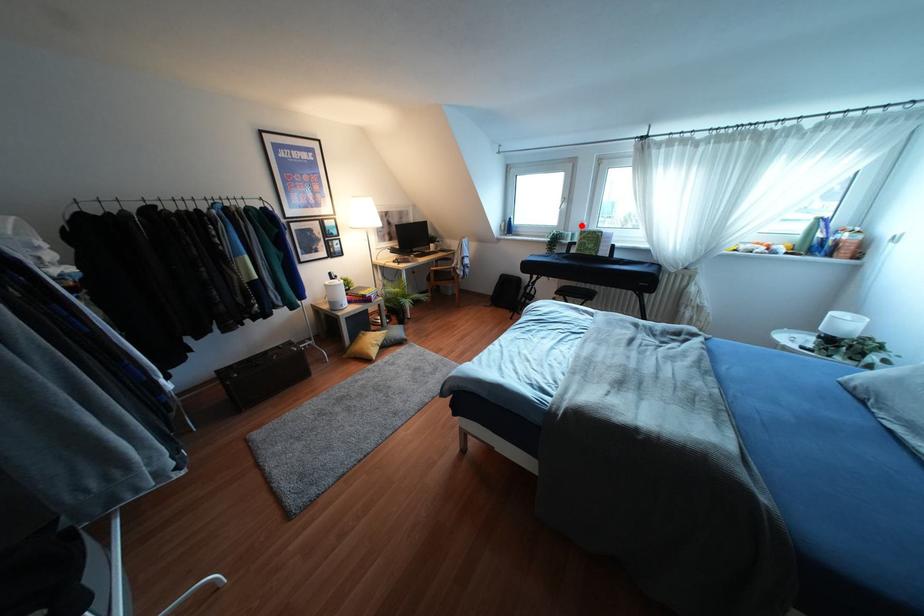
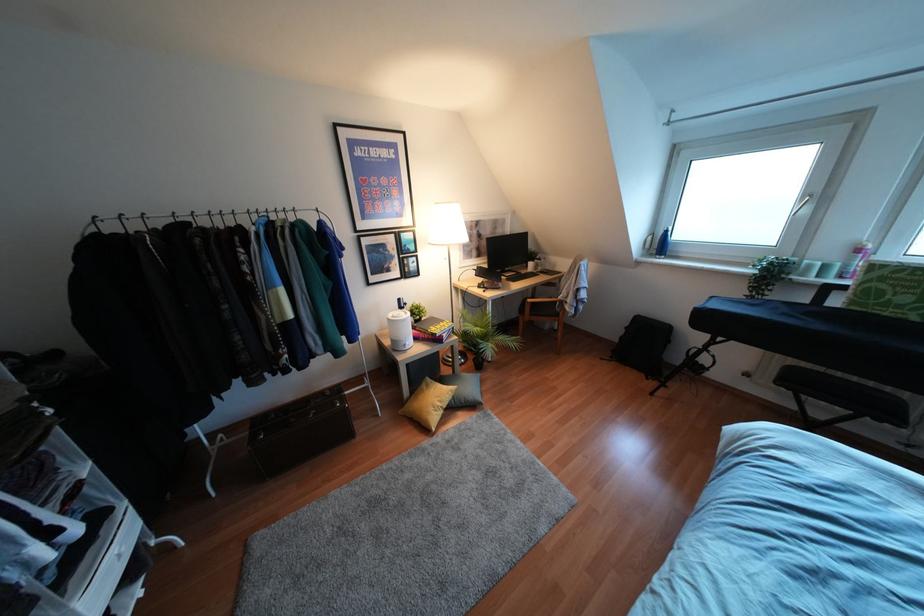
Find the pixel in the second image that matches the highlighted location in the first image.

(858, 249)